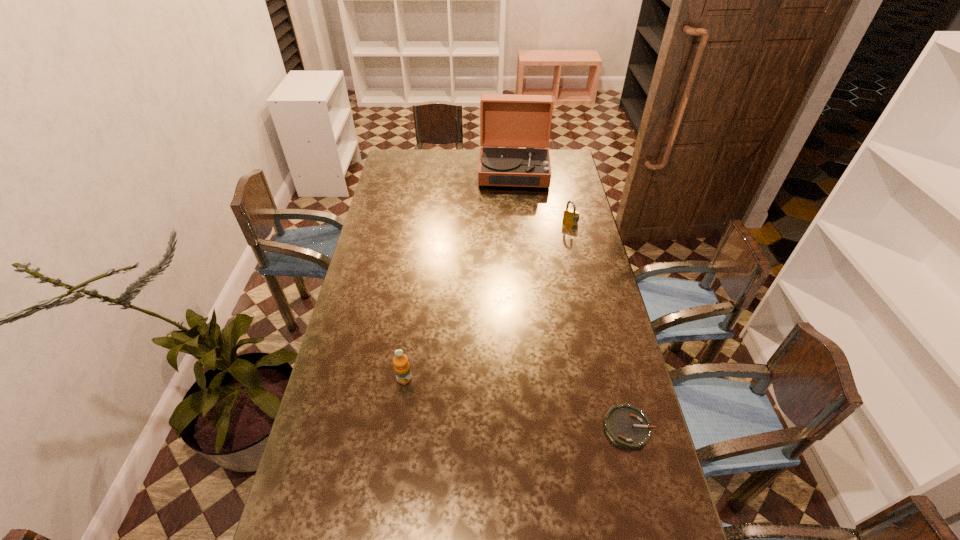
You are a GUI agent. You are given a task and a screenshot of the screen. Output one action in this format:
    pyautogui.click(x=<x>, y=<y>)
    Task: Click on the blank space located on the side with the combination dials of the padlock
    This screenshot has width=960, height=540.
    Given the screenshot: What is the action you would take?
    pyautogui.click(x=545, y=277)

Find the location of a particular element. This screenshot has width=960, height=540. free region located 0.160m on the side with the combination dials of the padlock is located at coordinates (558, 249).

The image size is (960, 540). In order to click on vacant area located on the side with the combination dials of the padlock in this screenshot , I will do `click(548, 271)`.

Identify the location of free space located on the face of the tallest object. (514, 197).

Where is `free space located on the face of the tallest object`? The width and height of the screenshot is (960, 540). free space located on the face of the tallest object is located at coordinates (514, 213).

Locate an element on the screen. vacant space located 0.300m on the face of the tallest object is located at coordinates (514, 230).

This screenshot has height=540, width=960. Find the location of `object that is at the far edge`. object that is at the far edge is located at coordinates (524, 121).

Locate an element on the screen. The width and height of the screenshot is (960, 540). ashtray located at the right edge is located at coordinates (627, 426).

Find the location of a particular element. padlock situated at the right edge is located at coordinates (571, 216).

Find the location of a particular element. phonograph record located at the right edge is located at coordinates (524, 121).